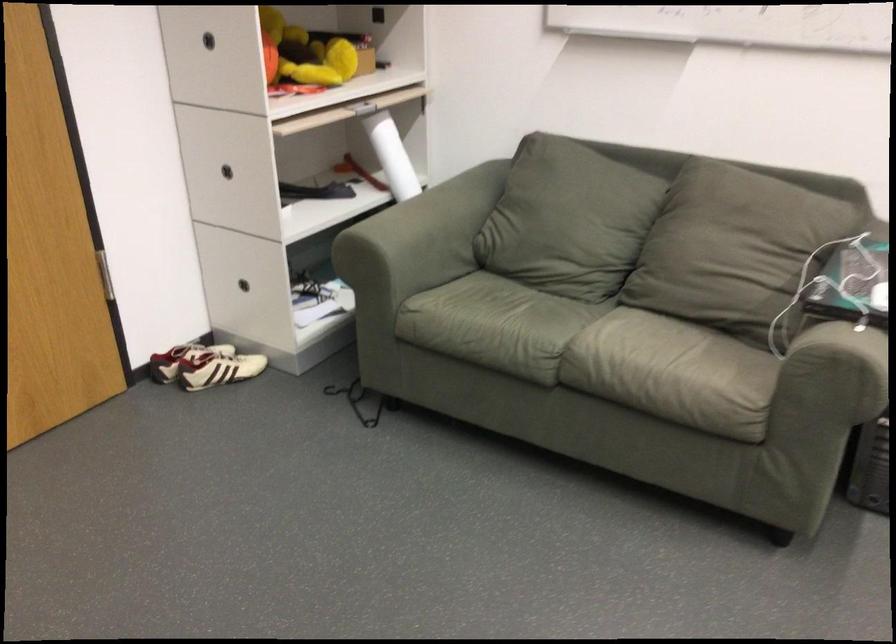
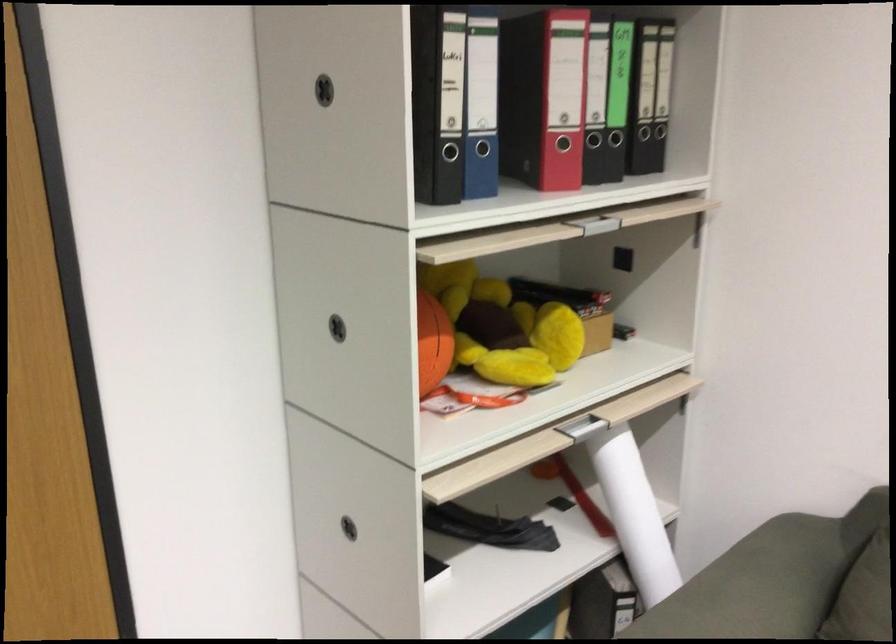
Question: I am providing you with two images of the same scene from different viewpoints. After the viewpoint changes to image2, which objects are now occluded?

Choices:
 (A) black drawer handle
 (B) binder finger hole
 (C) orange glass candle
 (D) shelf handle

Answer: (A)